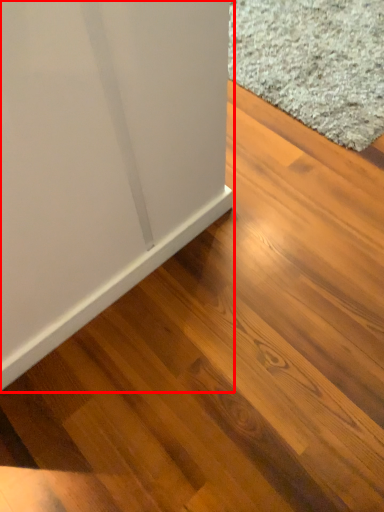
Question: From the image's perspective, what is the correct spatial relationship of furniture (annotated by the red box) in relation to doormat?

Choices:
 (A) below
 (B) above

Answer: (A)